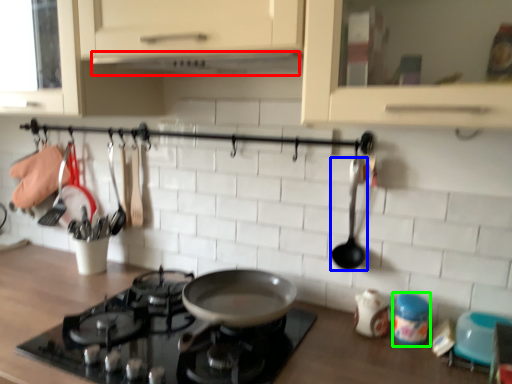
Question: Estimate the real-world distances between objects in this image. Which object is farther from exhaust hood (highlighted by a red box), spoon (highlighted by a blue box) or appliance (highlighted by a green box)?

Choices:
 (A) spoon
 (B) appliance

Answer: (B)